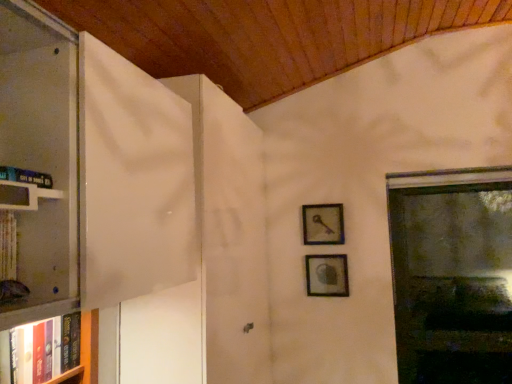
Question: Is white glossy bookshelf at left further to camera compared to hardcover book at left, placed as the 1th book when sorted from front to back?

Choices:
 (A) yes
 (B) no

Answer: (B)

Question: From a real-world perspective, is white glossy bookshelf at left over hardcover book at left, the 1th book positioned from the top?

Choices:
 (A) no
 (B) yes

Answer: (A)

Question: Does white glossy bookshelf at left turn towards hardcover book at left, placed as the 1th book when sorted from front to back?

Choices:
 (A) no
 (B) yes

Answer: (A)

Question: From the image's perspective, is white glossy bookshelf at left on top of hardcover book at left, arranged as the second book when ordered from the bottom?

Choices:
 (A) yes
 (B) no

Answer: (B)

Question: Can you confirm if white glossy bookshelf at left is shorter than hardcover book at left, which is the second book in back-to-front order?

Choices:
 (A) no
 (B) yes

Answer: (A)

Question: Is white glossy bookshelf at left to the left of hardcover book at left, the 1th book positioned from the top, from the viewer's perspective?

Choices:
 (A) no
 (B) yes

Answer: (A)

Question: Does transparent glass window at right have a larger size compared to metallic key at upper right, which is counted as the second picture frame, starting from the bottom?

Choices:
 (A) yes
 (B) no

Answer: (A)

Question: Is transparent glass window at right positioned beyond the bounds of metallic key at upper right, which is the first picture frame from top to bottom?

Choices:
 (A) yes
 (B) no

Answer: (A)

Question: Considering the relative positions of transparent glass window at right and metallic key at upper right, which is counted as the second picture frame, starting from the bottom, in the image provided, is transparent glass window at right in front of metallic key at upper right, which is counted as the second picture frame, starting from the bottom,?

Choices:
 (A) yes
 (B) no

Answer: (A)

Question: Considering the relative positions of transparent glass window at right and metallic key at upper right, which is counted as the second picture frame, starting from the bottom, in the image provided, is transparent glass window at right to the right of metallic key at upper right, which is counted as the second picture frame, starting from the bottom, from the viewer's perspective?

Choices:
 (A) no
 (B) yes

Answer: (B)

Question: Is transparent glass window at right to the left of metallic key at upper right, which is the first picture frame from top to bottom, from the viewer's perspective?

Choices:
 (A) no
 (B) yes

Answer: (A)

Question: From the image's perspective, is transparent glass window at right on top of metallic key at upper right, which is the first picture frame from top to bottom?

Choices:
 (A) no
 (B) yes

Answer: (A)

Question: From a real-world perspective, is hardcover book at left, the 2th book in the front-to-back sequence, positioned over metallic key at upper right, which is the first picture frame from top to bottom, based on gravity?

Choices:
 (A) no
 (B) yes

Answer: (A)